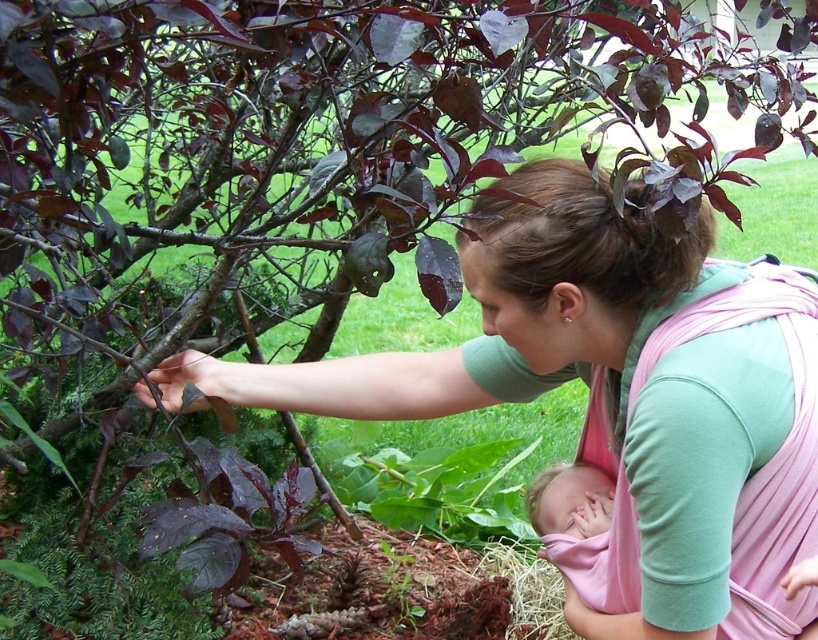
You are a photographer trying to capture the woman and the plant in the image. The pink fabric baby at center is blocking part of the plant. To get a clear shot of the plant, should you move the camera to the left or right?

The pink fabric baby at center is positioned at point (578,528). To avoid blocking the plant, move the camera to the left to capture the plant without obstruction.